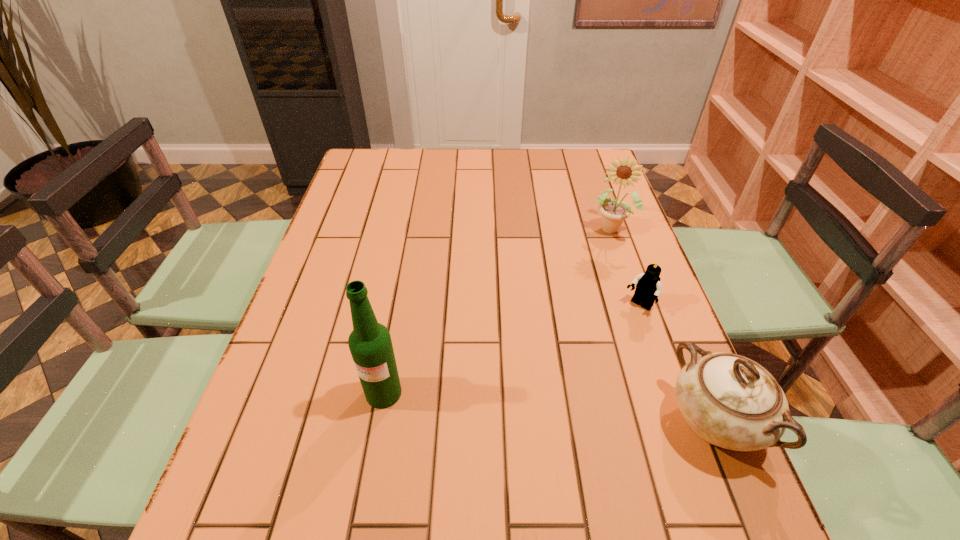
The image size is (960, 540). In order to click on the tallest object in this screenshot , I will do `click(370, 344)`.

You are a GUI agent. You are given a task and a screenshot of the screen. Output one action in this format:
    pyautogui.click(x=<x>, y=<y>)
    Task: Click on the leftmost object
    The width and height of the screenshot is (960, 540).
    Given the screenshot: What is the action you would take?
    pyautogui.click(x=370, y=344)

You are a GUI agent. You are given a task and a screenshot of the screen. Output one action in this format:
    pyautogui.click(x=<x>, y=<y>)
    Task: Click on the chinaware
    
    Given the screenshot: What is the action you would take?
    pyautogui.click(x=728, y=400)

Where is `the second tallest object`? The width and height of the screenshot is (960, 540). the second tallest object is located at coordinates (613, 212).

Locate an element on the screen. Image resolution: width=960 pixels, height=540 pixels. sunflower is located at coordinates (613, 212).

Where is `the second farthest object`? the second farthest object is located at coordinates (648, 286).

I want to click on the shortest object, so click(648, 286).

Identify the location of free space located 0.110m on the label of the tallest object. (371, 465).

Image resolution: width=960 pixels, height=540 pixels. I want to click on free spot located on the left of the chinaware, so click(475, 421).

You are a GUI agent. You are given a task and a screenshot of the screen. Output one action in this format:
    pyautogui.click(x=<x>, y=<y>)
    Task: Click on the vacant space located 0.280m on the front-facing side of the sunflower
    The width and height of the screenshot is (960, 540).
    Given the screenshot: What is the action you would take?
    (581, 312)